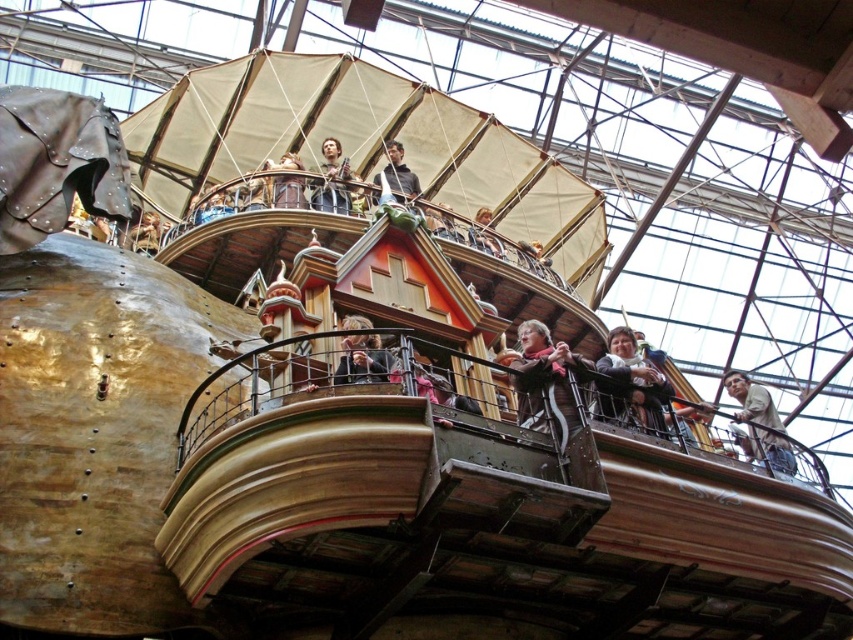
You are standing on the deck of the airship and notice two people wearing jackets. The person in the matte brown jacket at lower right and the person in the matte gray jacket at upper center. Which jacket is closer to you?

The matte brown jacket at lower right is closer to you because it is positioned in front of the matte gray jacket at upper center.

You are standing on the deck of the golden metallic ship at upper center and want to greet someone wearing the matte black jacket at center. In which direction should you walk to reach them?

The matte black jacket at center is to the left of the golden metallic ship at upper center, so you should walk to the left to reach them.